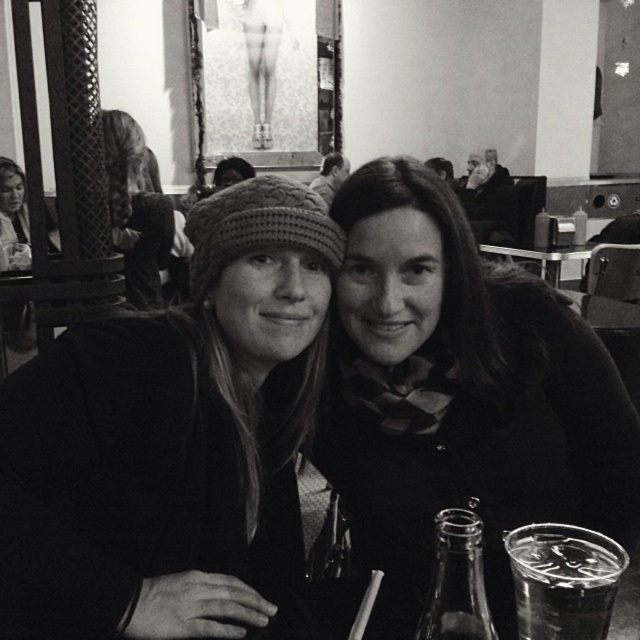
Does knitted wool hat at upper left have a smaller size compared to smooth black jacket at upper right?

Correct, knitted wool hat at upper left occupies less space than smooth black jacket at upper right.

Is point (154, 301) positioned behind point (467, 182)?

No, it is not.

Which is in front, point (122, 180) or point (483, 218)?

Point (122, 180)

Where is `knitted wool hat at upper left`? The image size is (640, 640). knitted wool hat at upper left is located at coordinates (134, 211).

I want to click on knitted wool hat at center, so click(x=172, y=440).

Does knitted wool hat at center have a larger size compared to transparent glass bottle at lower center?

Correct, knitted wool hat at center is larger in size than transparent glass bottle at lower center.

Does point (275, 570) lie behind point (426, 632)?

Yes, point (275, 570) is farther from viewer.

At what (x,y) coordinates should I click in order to perform the action: click on knitted wool hat at center. Please return your answer as a coordinate pair (x, y). Looking at the image, I should click on (172, 440).

Can you confirm if knitted wool hat at center is positioned to the left of matte black scarf at center?

Yes, knitted wool hat at center is to the left of matte black scarf at center.

Is point (58, 401) more distant than point (355, 316)?

That is False.

You are a GUI agent. You are given a task and a screenshot of the screen. Output one action in this format:
    pyautogui.click(x=<x>, y=<y>)
    Task: Click on the knitted wool hat at center
    The width and height of the screenshot is (640, 640).
    Given the screenshot: What is the action you would take?
    pyautogui.click(x=172, y=440)